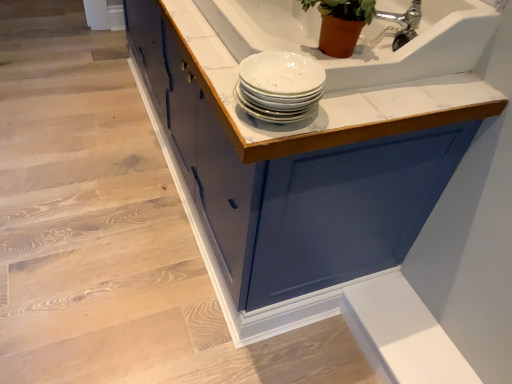
Question: Does matte blue cabinet at upper center appear on the left side of silver metallic faucet at upper right?

Choices:
 (A) yes
 (B) no

Answer: (A)

Question: From the image's perspective, would you say matte blue cabinet at upper center is shown under silver metallic faucet at upper right?

Choices:
 (A) yes
 (B) no

Answer: (B)

Question: Can you confirm if matte blue cabinet at upper center is taller than silver metallic faucet at upper right?

Choices:
 (A) yes
 (B) no

Answer: (A)

Question: Can you confirm if matte blue cabinet at upper center is thinner than silver metallic faucet at upper right?

Choices:
 (A) yes
 (B) no

Answer: (B)

Question: From the image's perspective, is matte blue cabinet at upper center over silver metallic faucet at upper right?

Choices:
 (A) no
 (B) yes

Answer: (B)

Question: Are matte blue cabinet at upper center and silver metallic faucet at upper right far apart?

Choices:
 (A) no
 (B) yes

Answer: (A)

Question: Is silver metallic faucet at upper right thinner than white glossy plates at upper center?

Choices:
 (A) no
 (B) yes

Answer: (B)

Question: From a real-world perspective, is silver metallic faucet at upper right beneath white glossy plates at upper center?

Choices:
 (A) no
 (B) yes

Answer: (A)

Question: Can white glossy plates at upper center be found inside silver metallic faucet at upper right?

Choices:
 (A) yes
 (B) no

Answer: (B)

Question: Can you see silver metallic faucet at upper right touching white glossy plates at upper center?

Choices:
 (A) yes
 (B) no

Answer: (B)

Question: Is silver metallic faucet at upper right positioned beyond the bounds of white glossy plates at upper center?

Choices:
 (A) yes
 (B) no

Answer: (A)

Question: From the image's perspective, is silver metallic faucet at upper right over white glossy plates at upper center?

Choices:
 (A) no
 (B) yes

Answer: (B)

Question: Does white glossy plates at upper center appear on the right side of silver metallic faucet at upper right?

Choices:
 (A) no
 (B) yes

Answer: (A)